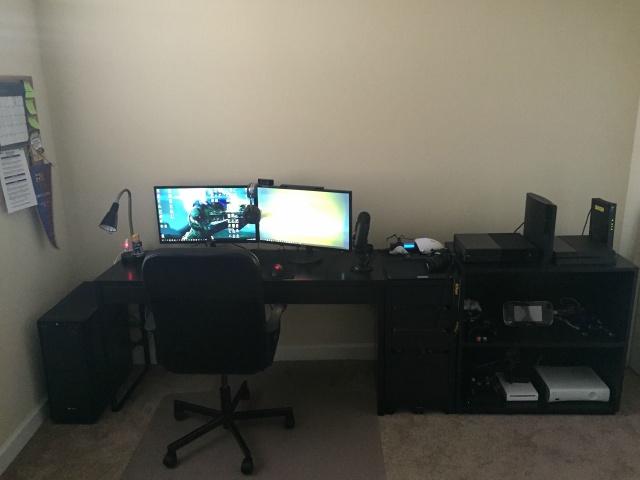
Identify the location of pennant. (43, 188).